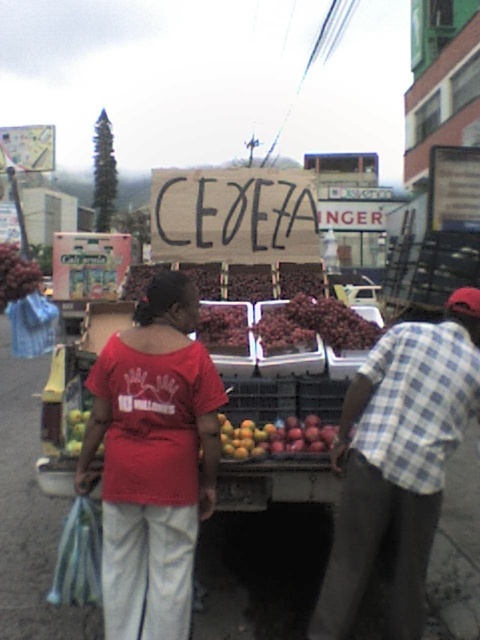
Question: Is the position of blue checkered shirt at center more distant than that of shiny purple grapes at center?

Choices:
 (A) yes
 (B) no

Answer: (B)

Question: Which object appears farthest from the camera in this image?

Choices:
 (A) ripe red grapes at left
 (B) blue checkered shirt at center
 (C) ripe red grapes at center
 (D) shiny purple grapes at center

Answer: (A)

Question: Which of the following is the closest to the observer?

Choices:
 (A) (207, 348)
 (B) (402, 378)

Answer: (B)

Question: Is blue checkered shirt at center to the left of shiny purple grapes at center from the viewer's perspective?

Choices:
 (A) yes
 (B) no

Answer: (B)

Question: Among these points, which one is farthest from the camera?

Choices:
 (A) (280, 326)
 (B) (201, 314)
 (C) (195, 355)

Answer: (B)

Question: Can you confirm if shiny purple grapes at center is positioned to the left of ripe red grapes at left?

Choices:
 (A) yes
 (B) no

Answer: (B)